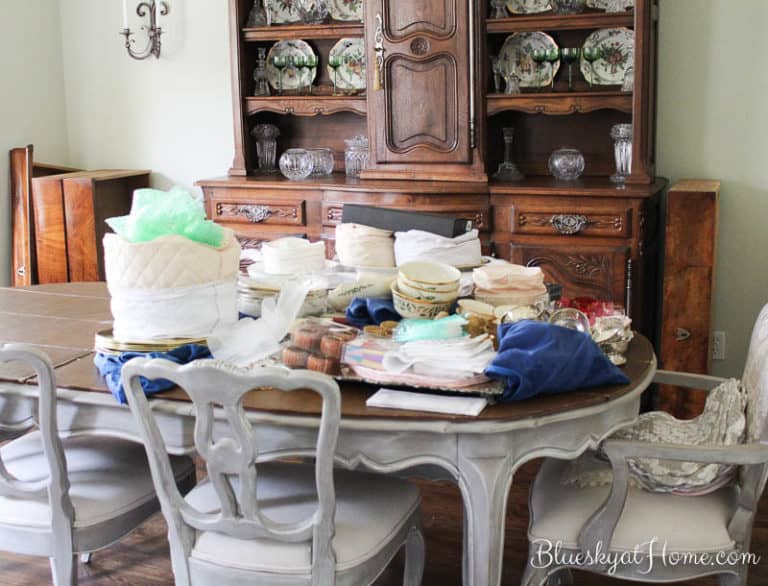
Find the location of a particular element. The image size is (768, 586). wooden drawers is located at coordinates (686, 250), (80, 199), (45, 203), (20, 210).